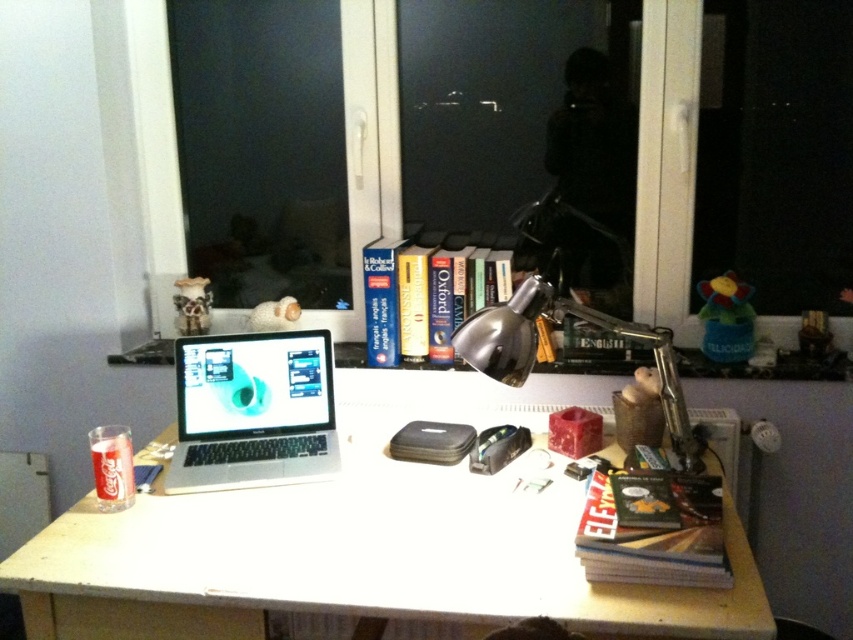
You are organizing items on the desk and need to place a new item between the white matte table at center and the hardcover book at lower right. Based on their positions, where should you place the new item?

The white matte table at center is in front of the hardcover book at lower right, so you should place the new item between them by positioning it in front of the hardcover book at lower right but behind the white matte table at center.